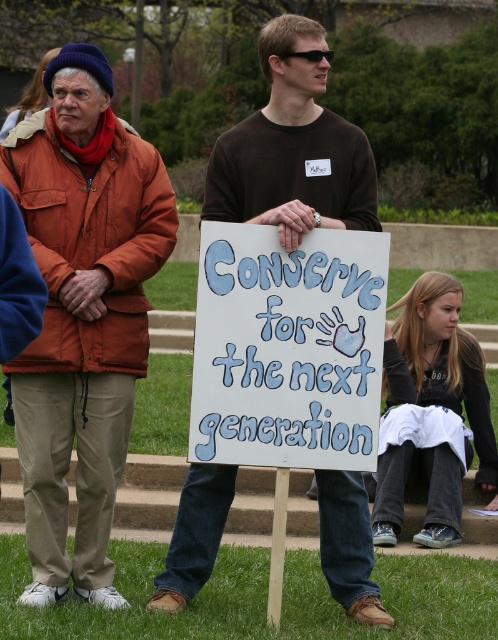
You are a photographer trying to capture a clear photo of the white painted wood sign at center. The orange fabric jacket at left is blocking part of the sign. Can you estimate if the jacket is narrower than the sign so that you can adjust your angle to avoid the obstruction?

The orange fabric jacket at left is thinner than the white painted wood sign at center, so adjusting the angle to the right might allow capturing the entire sign without obstruction.